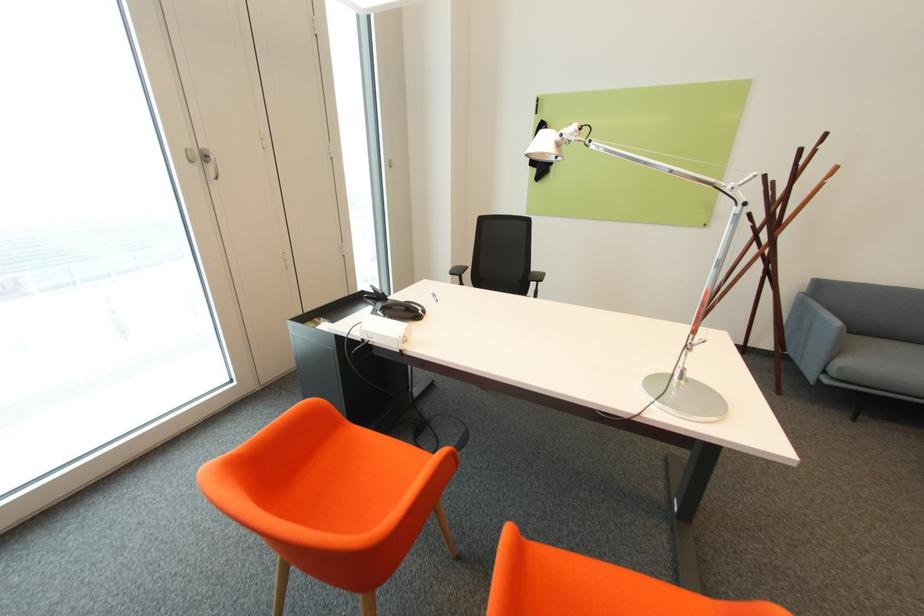
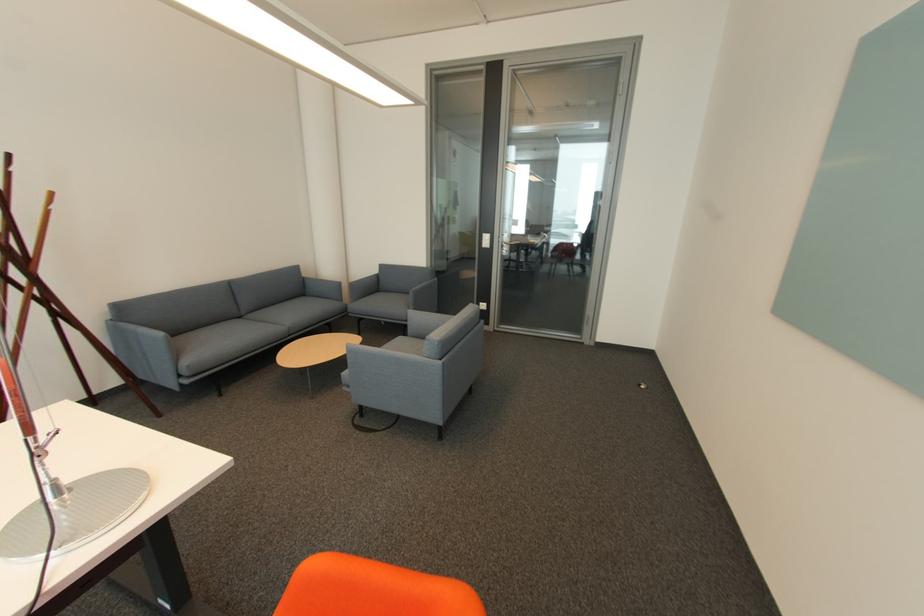
In the second image, find the point that corresponds to (823,306) in the first image.

(139, 328)